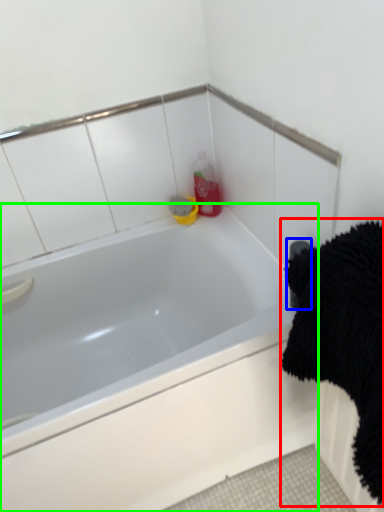
Question: Which object is positioned closest to bath towel (highlighted by a red box)? Select from towel bar (highlighted by a blue box) and bathtub (highlighted by a green box).

Choices:
 (A) towel bar
 (B) bathtub

Answer: (A)